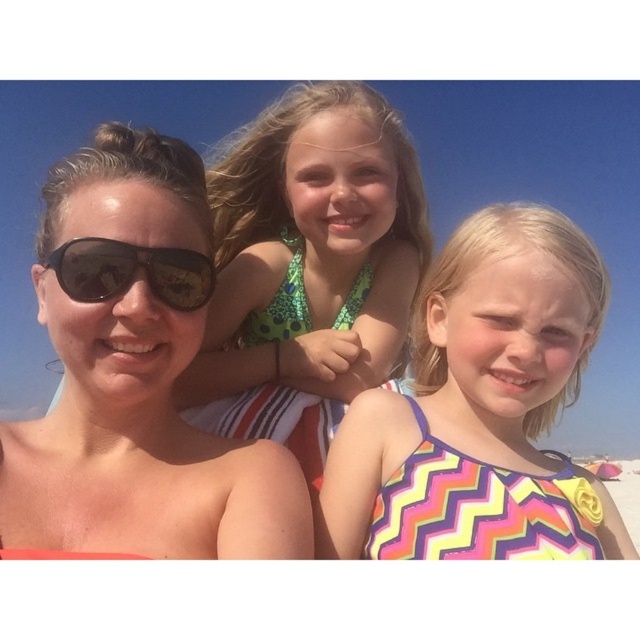
You are a photographer trying to capture a clear shot of the multicolored zigzag swimsuit at center and the black reflective sunglasses at left. Based on their sizes, which object should you focus on first to ensure it fits entirely within the frame?

The multicolored zigzag swimsuit at center is larger in size than the black reflective sunglasses at left, so you should focus on capturing the multicolored zigzag swimsuit at center first to ensure it fits entirely within the frame.

You are a photographer trying to capture a closeup of the matte black sunglasses at left and the multicolored zigzag swimsuit at center. Which object would require a wider lens opening to ensure proper focus?

The multicolored zigzag swimsuit at center requires a wider lens opening because it is thicker than the matte black sunglasses at left.